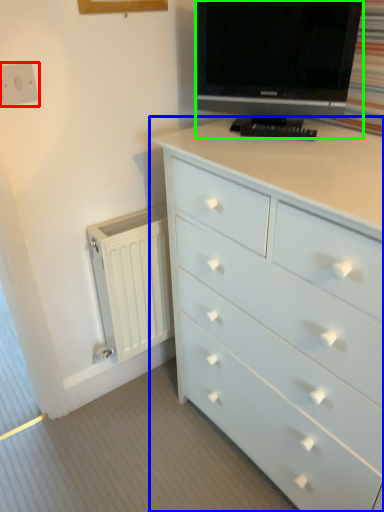
Question: Which is nearer to the electric outlet (highlighted by a red box)? chest of drawers (highlighted by a blue box) or television (highlighted by a green box).

Choices:
 (A) chest of drawers
 (B) television

Answer: (B)